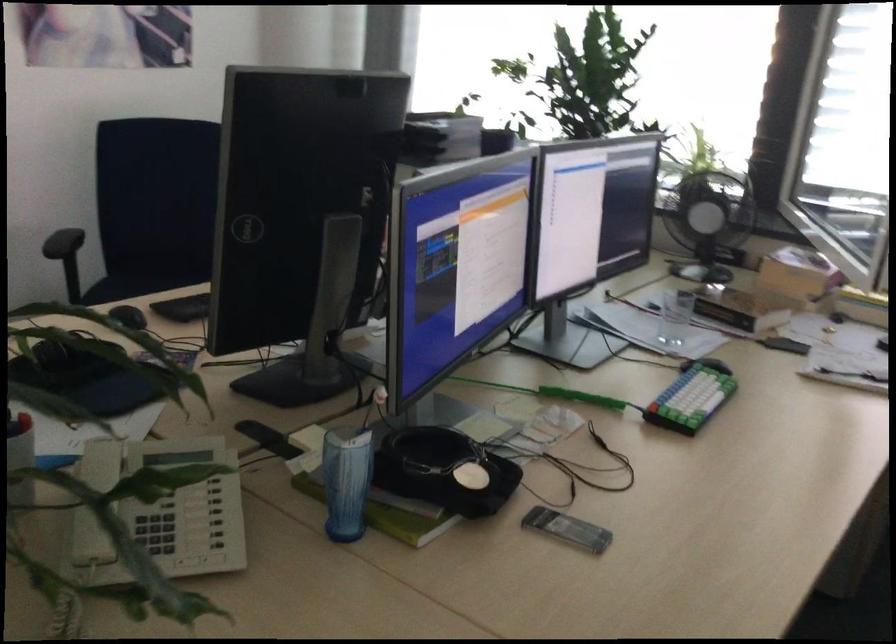
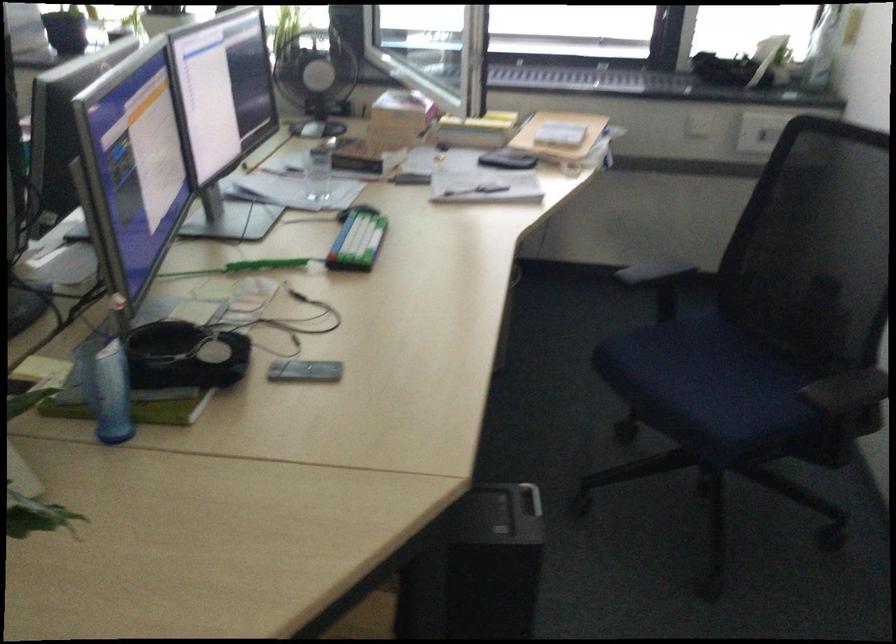
The point at [444,469] is marked in the first image. Where is the corresponding point in the second image?

(185, 355)